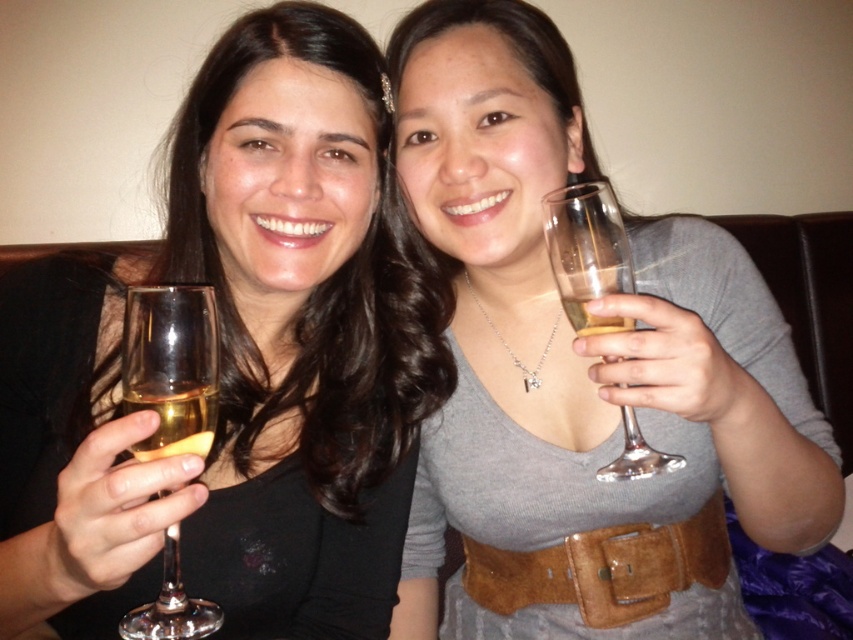
In the scene shown: You are a bartender trying to determine which wine glass to use for a new cocktail recipe. Both the clear glass wine glass at left and the clear glass wine glass at right are available. Based on their sizes, which one can hold more liquid?

The clear glass wine glass at right can hold more liquid because it occupies more space than the clear glass wine glass at left.

You are standing in front of the image. There is a point labeled as point (171, 365). What object in the image corresponds to this point?

The point (171, 365) corresponds to the clear glass wine glass at left.

You are a photographer adjusting the focus of your camera. You notice two glasses on the left side of the image. Can you determine if the clear glass wine glass at left and the translucent glass at left are close enough to be in the same focus zone?

The clear glass wine glass at left is 1.16 inches away from the translucent glass at left. Since the distance between them is minimal, they can likely be captured in the same focus zone.